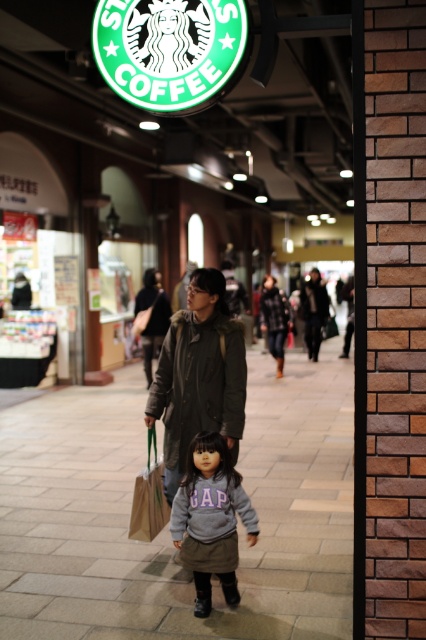
Can you confirm if dark gray wool coat at center is shorter than gray fleece sweatshirt at center?

No.

Does dark gray wool coat at center appear on the right side of gray fleece sweatshirt at center?

No, dark gray wool coat at center is not to the right of gray fleece sweatshirt at center.

Which is in front, point (281, 340) or point (270, 305)?

Point (281, 340)

You are a GUI agent. You are given a task and a screenshot of the screen. Output one action in this format:
    pyautogui.click(x=<x>, y=<y>)
    Task: Click on the dark gray wool coat at center
    Image resolution: width=426 pixels, height=640 pixels.
    Given the screenshot: What is the action you would take?
    pyautogui.click(x=275, y=320)

Can you confirm if smooth concrete pavement at center is smaller than gray fleece hoodie at center?

No.

Is point (34, 560) closer to viewer compared to point (198, 564)?

No, (34, 560) is behind (198, 564).

Which is in front, point (103, 512) or point (215, 472)?

Point (215, 472) is in front.

Where is `smooth concrete pavement at center`? This screenshot has width=426, height=640. smooth concrete pavement at center is located at coordinates (166, 525).

Between point (324, 400) and point (268, 326), which one is positioned in front?

Positioned in front is point (324, 400).

In the scene shown: Does smooth concrete pavement at center lie behind gray fleece sweatshirt at center?

No, it is in front of gray fleece sweatshirt at center.

Which is behind, point (288, 628) or point (282, 323)?

Positioned behind is point (282, 323).

The image size is (426, 640). Identify the location of smooth concrete pavement at center. (166, 525).